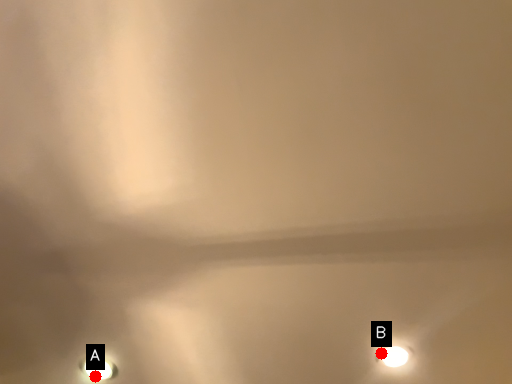
Question: Two points are circled on the image, labeled by A and B beside each circle. Which point is closer to the camera?

Choices:
 (A) A is closer
 (B) B is closer

Answer: (B)